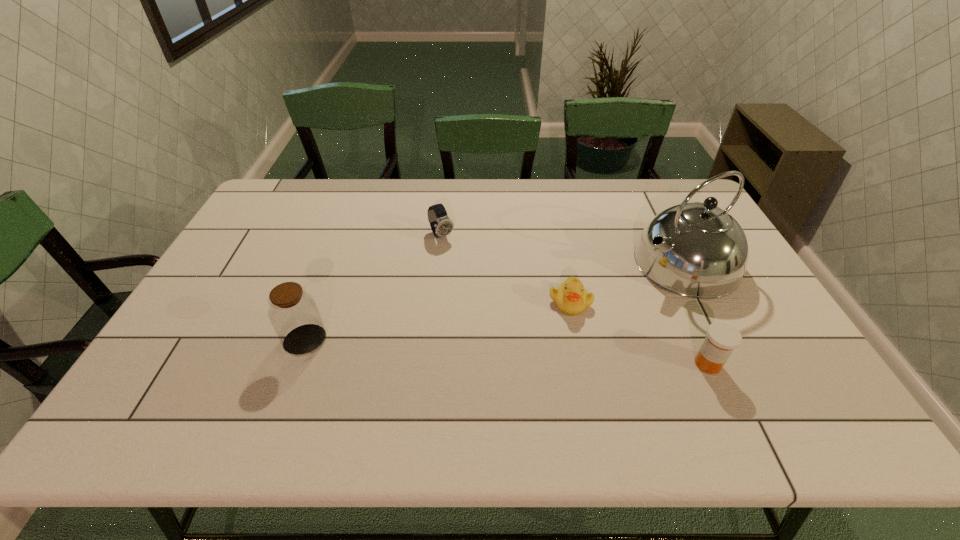
In order to click on vacant space on the desktop that is between the leftmost object and the medicine and is positioned on the beak of the third object from left to right in this screenshot , I will do `click(516, 353)`.

Image resolution: width=960 pixels, height=540 pixels. Identify the location of vacant space on the desktop that is between the fourth shortest object and the medicine and is positioned on the face of the second object from left to right. (535, 354).

I want to click on vacant space on the desktop that is between the jar and the medicine and is positioned from the spout of the tallest object, so pyautogui.click(x=481, y=350).